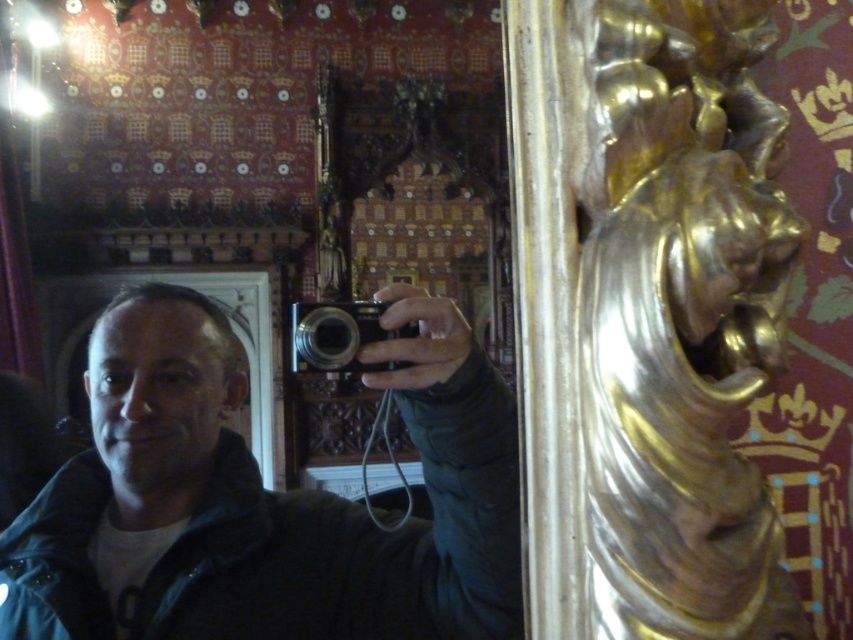
How much distance is there between matte black camera at center and black plastic camera at center?

The distance of matte black camera at center from black plastic camera at center is 7.88 meters.

Does point (190, 630) come behind point (347, 332)?

Yes, it is.

Locate an element on the screen. The image size is (853, 640). matte black camera at center is located at coordinates (265, 497).

Where is `matte black camera at center`? matte black camera at center is located at coordinates (265, 497).